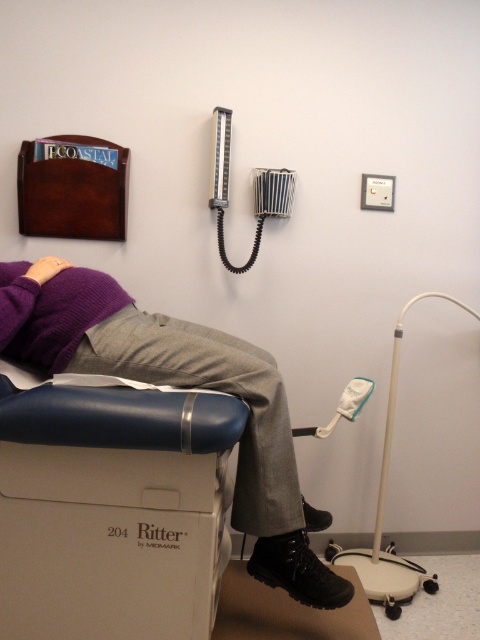
Question: Can you confirm if black leather boot at lower center is positioned to the right of striped fabric blood pressure cuff at upper center?

Choices:
 (A) yes
 (B) no

Answer: (A)

Question: Where is white plastic floor lamp at lower right located in relation to striped fabric blood pressure cuff at upper center in the image?

Choices:
 (A) right
 (B) left

Answer: (A)

Question: Which point is farther to the camera?

Choices:
 (A) white plastic floor lamp at lower right
 (B) purple sweater at upper left
 (C) striped fabric blood pressure cuff at upper center
 (D) black leather boot at lower center

Answer: (C)

Question: Which is farther from the striped fabric blood pressure cuff at upper center?

Choices:
 (A) purple sweater at upper left
 (B) black leather boot at lower center

Answer: (B)

Question: Which point is closer to the camera?

Choices:
 (A) white plastic floor lamp at lower right
 (B) purple sweater at upper left
 (C) black leather boot at lower center
 (D) striped fabric blood pressure cuff at upper center

Answer: (B)

Question: Can you confirm if white plastic floor lamp at lower right is positioned below striped fabric blood pressure cuff at upper center?

Choices:
 (A) yes
 (B) no

Answer: (A)